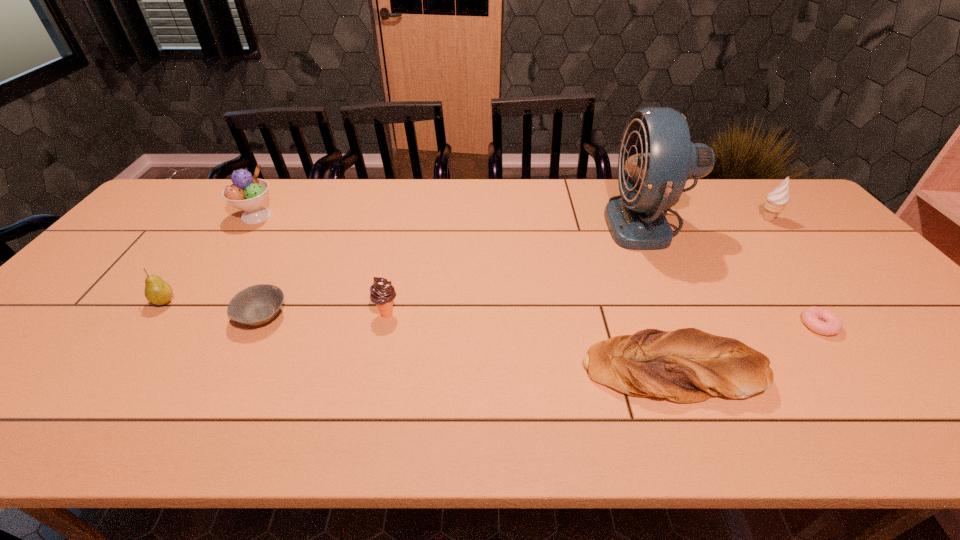
Identify which object is located as the sixth nearest to the tallest object. Please provide its 2D coordinates. Your answer should be formatted as a tuple, i.e. [(x, y)], where the tuple contains the x and y coordinates of a point satisfying the conditions above.

[(247, 193)]

Where is `object that is the closest to the rightmost icecream`? Image resolution: width=960 pixels, height=540 pixels. object that is the closest to the rightmost icecream is located at coordinates (656, 157).

Where is `icecream that is the third closest one to the shortest object`? The height and width of the screenshot is (540, 960). icecream that is the third closest one to the shortest object is located at coordinates (247, 193).

This screenshot has height=540, width=960. I want to click on icecream that stands as the closest to the fan, so click(777, 200).

Identify the location of vacant space that satisfies the following two spatial constraints: 1. on the back side of the shortest icecream; 2. on the left side of the bowl. (263, 314).

Where is `vacant space that satisfies the following two spatial constraints: 1. on the back side of the leftmost icecream; 2. on the left side of the fifth tallest object`? vacant space that satisfies the following two spatial constraints: 1. on the back side of the leftmost icecream; 2. on the left side of the fifth tallest object is located at coordinates (228, 217).